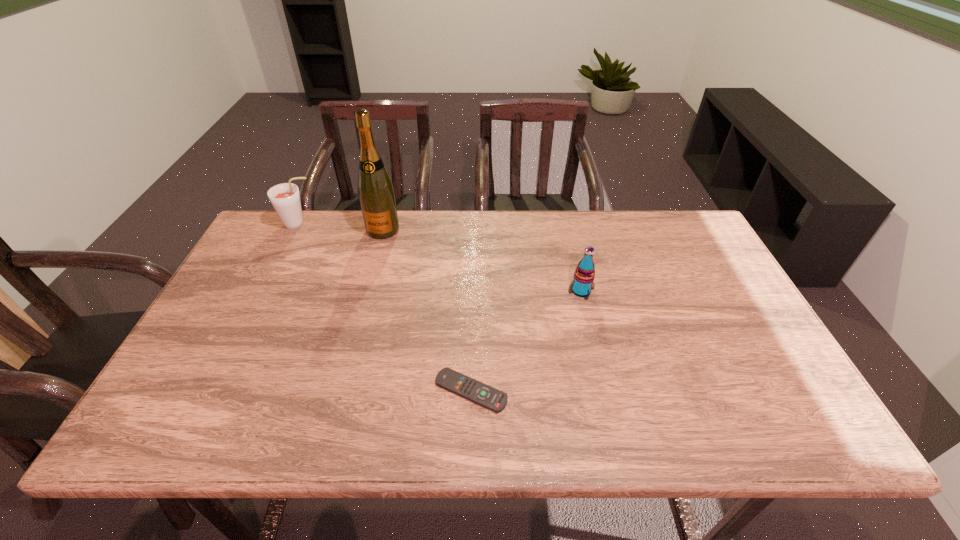
In order to click on the tallest object in this screenshot , I will do coord(376,193).

This screenshot has width=960, height=540. What are the coordinates of `wine bottle` in the screenshot? It's located at (376, 193).

Locate an element on the screen. This screenshot has width=960, height=540. the leftmost object is located at coordinates (285, 198).

Locate an element on the screen. the rightmost object is located at coordinates (584, 275).

Locate an element on the screen. The image size is (960, 540). the third farthest object is located at coordinates (584, 275).

This screenshot has width=960, height=540. In order to click on the nearest object in this screenshot , I will do `click(475, 391)`.

Identify the location of remote control. This screenshot has height=540, width=960. (475, 391).

Find the location of a particular element. This screenshot has height=540, width=960. blank space located on the front-facing side of the second object from left to right is located at coordinates (360, 315).

Find the location of a particular element. vacant region located 0.090m on the drink side of the root beer is located at coordinates (345, 225).

The image size is (960, 540). I want to click on vacant space situated 0.230m on the right of the rightmost object, so click(x=677, y=291).